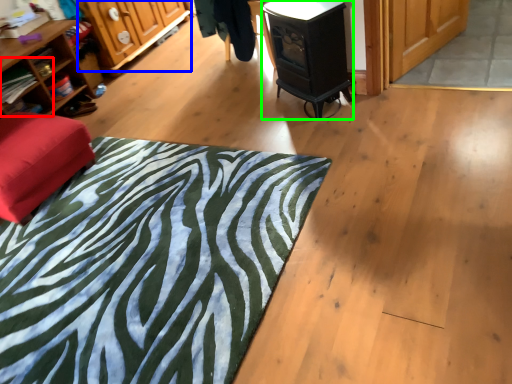
Question: Based on their relative distances, which object is nearer to shelf (highlighted by a red box)? Choose from cabinetry (highlighted by a blue box) and stove (highlighted by a green box).

Choices:
 (A) cabinetry
 (B) stove

Answer: (A)